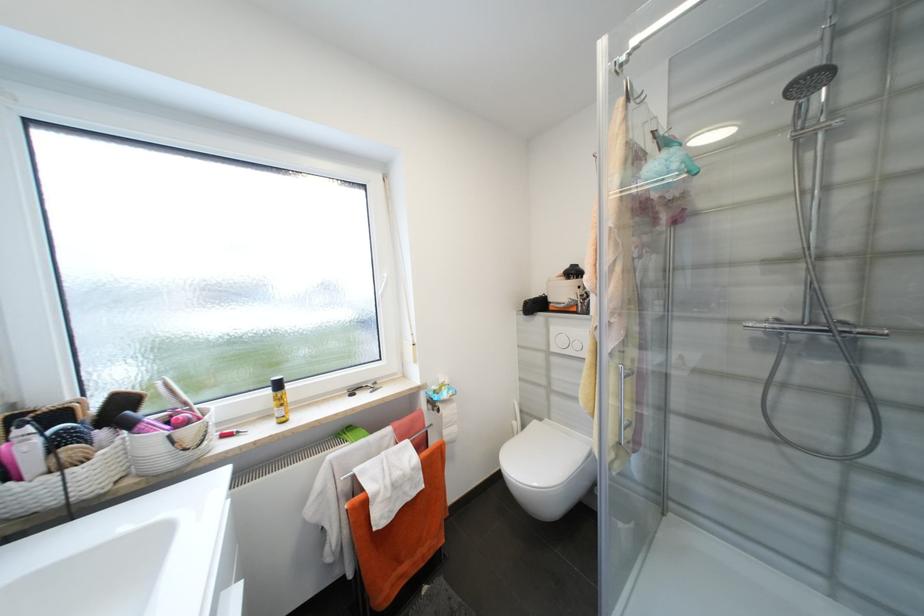
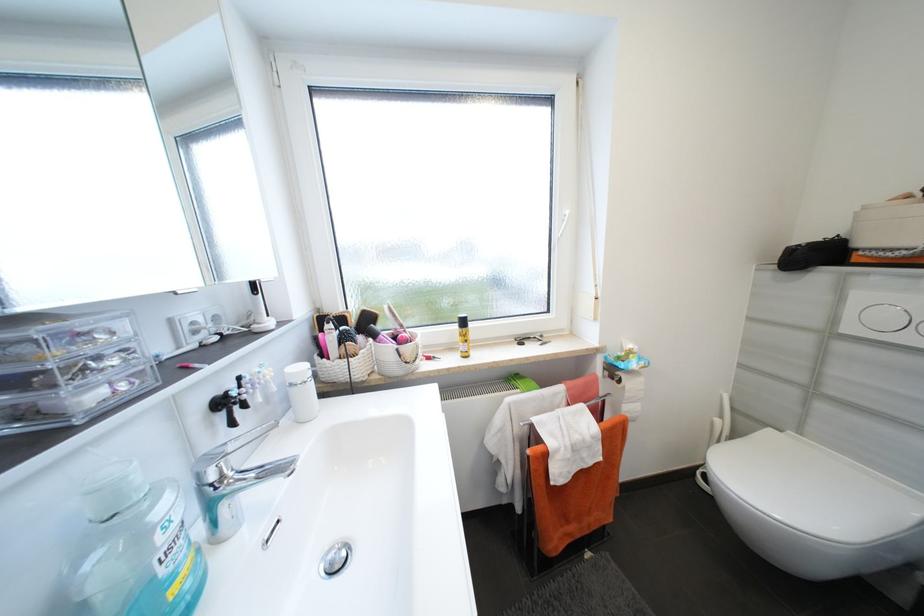
Question: The first image is from the beginning of the video and the second image is from the end. How did the camera likely rotate when shooting the video?

Choices:
 (A) Left
 (B) Right
 (C) Up
 (D) Down

Answer: (A)